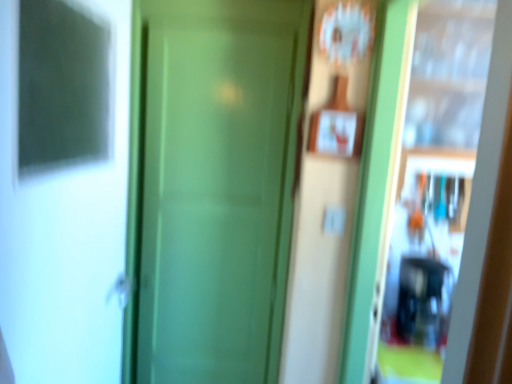
Identify the location of green matte door at center. This screenshot has width=512, height=384. (217, 186).

Can you confirm if green matte door at center is wider than green matte screen door at center, the 2th screen door when ordered from left to right?

No, green matte door at center is not wider than green matte screen door at center, the 2th screen door when ordered from left to right.

From a real-world perspective, which object rests below the other?

green matte door at center is physically lower.

Relative to green matte screen door at center, the 2th screen door when ordered from left to right, is green matte door at center in front or behind?

Clearly, green matte door at center is behind green matte screen door at center, the 2th screen door when ordered from left to right.

From the image's perspective, relative to white glossy screen door at left, the 1th screen door in the left-to-right sequence, is green matte screen door at center, positioned as the 1th screen door in right-to-left order, above or below?

green matte screen door at center, positioned as the 1th screen door in right-to-left order, is situated lower than white glossy screen door at left, the 1th screen door in the left-to-right sequence, in the image.

Which object is more forward, green matte screen door at center, the 2th screen door when ordered from left to right, or white glossy screen door at left, the 1th screen door in the left-to-right sequence?

white glossy screen door at left, the 1th screen door in the left-to-right sequence, is more forward.

Is point (394, 233) in front of point (29, 130)?

No, (394, 233) is behind (29, 130).

Between green matte screen door at center, the 2th screen door when ordered from left to right, and white glossy screen door at left, positioned as the 2th screen door in right-to-left order, which one appears on the left side from the viewer's perspective?

white glossy screen door at left, positioned as the 2th screen door in right-to-left order, is more to the left.

How many degrees apart are the facing directions of green matte screen door at center, the 2th screen door when ordered from left to right, and green matte door at center?

The angular difference between green matte screen door at center, the 2th screen door when ordered from left to right, and green matte door at center is 91.6 degrees.

How distant is green matte screen door at center, the 2th screen door when ordered from left to right, from green matte door at center?

27.54 inches.

In the scene shown: From a real-world perspective, which is physically above, green matte screen door at center, the 2th screen door when ordered from left to right, or green matte door at center?

From a 3D spatial view, green matte screen door at center, the 2th screen door when ordered from left to right, is above.

In terms of width, does green matte screen door at center, the 2th screen door when ordered from left to right, look wider or thinner when compared to green matte door at center?

Clearly, green matte screen door at center, the 2th screen door when ordered from left to right, has more width compared to green matte door at center.

Image resolution: width=512 pixels, height=384 pixels. What are the coordinates of `door on the right side of white glossy screen door at left, the 1th screen door in the left-to-right sequence` in the screenshot? It's located at (217, 186).

Can you tell me how much green matte door at center and white glossy screen door at left, positioned as the 2th screen door in right-to-left order, differ in facing direction?

The angular difference between green matte door at center and white glossy screen door at left, positioned as the 2th screen door in right-to-left order, is 89.4 degrees.

From a real-world perspective, which is physically below, green matte door at center or white glossy screen door at left, positioned as the 2th screen door in right-to-left order?

green matte door at center, from a real-world perspective.

Measure the distance from green matte door at center to white glossy screen door at left, positioned as the 2th screen door in right-to-left order.

They are 19.29 inches apart.

Between white glossy screen door at left, positioned as the 2th screen door in right-to-left order, and green matte screen door at center, the 2th screen door when ordered from left to right, which one has more height?

With more height is green matte screen door at center, the 2th screen door when ordered from left to right.

Which is correct: white glossy screen door at left, the 1th screen door in the left-to-right sequence, is inside green matte screen door at center, positioned as the 1th screen door in right-to-left order, or outside of it?

The correct answer is: outside.

Is white glossy screen door at left, positioned as the 2th screen door in right-to-left order, positioned behind green matte screen door at center, the 2th screen door when ordered from left to right?

No, white glossy screen door at left, positioned as the 2th screen door in right-to-left order, is closer to the camera.

From a real-world perspective, is white glossy screen door at left, the 1th screen door in the left-to-right sequence, under green matte door at center?

Actually, white glossy screen door at left, the 1th screen door in the left-to-right sequence, is physically above green matte door at center in the real world.

Is white glossy screen door at left, positioned as the 2th screen door in right-to-left order, located outside green matte door at center?

Absolutely, white glossy screen door at left, positioned as the 2th screen door in right-to-left order, is external to green matte door at center.

Between white glossy screen door at left, the 1th screen door in the left-to-right sequence, and green matte door at center, which one has more height?

green matte door at center is taller.

Considering the points (51, 161) and (204, 371), which point is in front, point (51, 161) or point (204, 371)?

The point (51, 161) is closer to the camera.

At what (x,y) coordinates should I click in order to perform the action: click on the 1st screen door in front of the green matte door at center. Please return your answer as a coordinate pair (x, y). Looking at the image, I should click on (457, 249).

Where is `screen door below the white glossy screen door at left, positioned as the 2th screen door in right-to-left order (from the image's perspective)`? screen door below the white glossy screen door at left, positioned as the 2th screen door in right-to-left order (from the image's perspective) is located at coordinates (457, 249).

Based on their spatial positions, is white glossy screen door at left, positioned as the 2th screen door in right-to-left order, or green matte door at center closer to green matte screen door at center, the 2th screen door when ordered from left to right?

green matte door at center is positioned closer to the anchor green matte screen door at center, the 2th screen door when ordered from left to right.

Looking at the image, which one is located closer to green matte door at center, white glossy screen door at left, the 1th screen door in the left-to-right sequence, or green matte screen door at center, positioned as the 1th screen door in right-to-left order?

Among the two, white glossy screen door at left, the 1th screen door in the left-to-right sequence, is located nearer to green matte door at center.

Looking at the image, which one is located further to white glossy screen door at left, the 1th screen door in the left-to-right sequence, green matte screen door at center, the 2th screen door when ordered from left to right, or green matte door at center?

green matte screen door at center, the 2th screen door when ordered from left to right, is positioned further to the anchor white glossy screen door at left, the 1th screen door in the left-to-right sequence.

Which object lies nearer to the anchor point green matte door at center, green matte screen door at center, positioned as the 1th screen door in right-to-left order, or white glossy screen door at left, the 1th screen door in the left-to-right sequence?

white glossy screen door at left, the 1th screen door in the left-to-right sequence.

Considering their positions, is green matte door at center positioned closer to green matte screen door at center, the 2th screen door when ordered from left to right, than white glossy screen door at left, the 1th screen door in the left-to-right sequence?

green matte door at center lies closer to green matte screen door at center, the 2th screen door when ordered from left to right, than the other object.

Based on their spatial positions, is green matte door at center or green matte screen door at center, the 2th screen door when ordered from left to right, further from white glossy screen door at left, the 1th screen door in the left-to-right sequence?

Based on the image, green matte screen door at center, the 2th screen door when ordered from left to right, appears to be further to white glossy screen door at left, the 1th screen door in the left-to-right sequence.

Find the location of a particular element. This screenshot has height=384, width=512. screen door located between white glossy screen door at left, the 1th screen door in the left-to-right sequence, and green matte door at center in the depth direction is located at coordinates (457, 249).